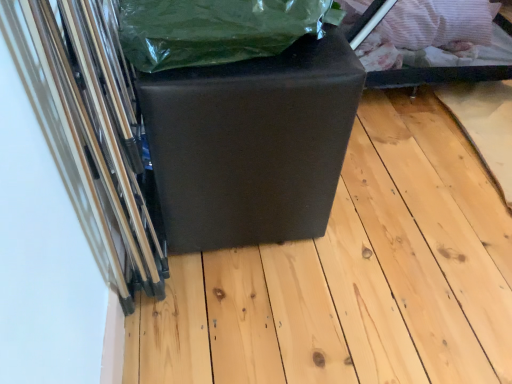
Question: Is matte black cube at center at the left side of green plastic bag at upper center?

Choices:
 (A) no
 (B) yes

Answer: (A)

Question: Is matte black cube at center thinner than green plastic bag at upper center?

Choices:
 (A) yes
 (B) no

Answer: (B)

Question: From the image's perspective, is matte black cube at center beneath green plastic bag at upper center?

Choices:
 (A) yes
 (B) no

Answer: (A)

Question: Is green plastic bag at upper center surrounded by matte black cube at center?

Choices:
 (A) no
 (B) yes

Answer: (A)

Question: Is the depth of matte black cube at center less than that of green plastic bag at upper center?

Choices:
 (A) no
 (B) yes

Answer: (A)

Question: From the image's perspective, relative to matte black cube at center, is green plastic bag at upper center above or below?

Choices:
 (A) above
 (B) below

Answer: (A)

Question: In the image, is green plastic bag at upper center on the left side or the right side of matte black cube at center?

Choices:
 (A) left
 (B) right

Answer: (A)

Question: From a real-world perspective, is green plastic bag at upper center above or below matte black cube at center?

Choices:
 (A) below
 (B) above

Answer: (B)

Question: In the image, is green plastic bag at upper center positioned in front of or behind matte black cube at center?

Choices:
 (A) front
 (B) behind

Answer: (A)

Question: From a real-world perspective, relative to matte black cube at center, is green plastic bag at upper center vertically above or below?

Choices:
 (A) above
 (B) below

Answer: (A)

Question: In terms of height, does green plastic bag at upper center look taller or shorter compared to matte black cube at center?

Choices:
 (A) tall
 (B) short

Answer: (B)

Question: Is green plastic bag at upper center in front of or behind matte black cube at center in the image?

Choices:
 (A) front
 (B) behind

Answer: (A)

Question: From the image's perspective, relative to matte black cube at center, is green plastic bag at upper center above or below?

Choices:
 (A) below
 (B) above

Answer: (B)

Question: Relative to matte black cube at center, is matte black cube at center in front or behind?

Choices:
 (A) front
 (B) behind

Answer: (B)

Question: In terms of height, does matte black cube at center look taller or shorter compared to matte black cube at center?

Choices:
 (A) short
 (B) tall

Answer: (A)